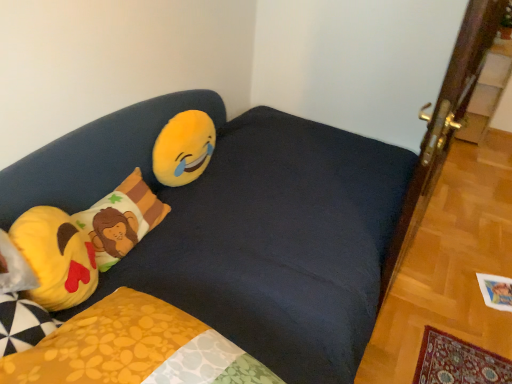
Question: Can you confirm if dark blue fabric studio couch at upper left is smaller than yellow plush emoji at upper left?

Choices:
 (A) no
 (B) yes

Answer: (A)

Question: Is dark blue fabric studio couch at upper left shorter than yellow plush emoji at upper left?

Choices:
 (A) yes
 (B) no

Answer: (B)

Question: Is dark blue fabric studio couch at upper left aimed at yellow plush emoji at upper left?

Choices:
 (A) no
 (B) yes

Answer: (A)

Question: Can you confirm if dark blue fabric studio couch at upper left is bigger than yellow plush emoji at upper left?

Choices:
 (A) no
 (B) yes

Answer: (B)

Question: Is dark blue fabric studio couch at upper left to the right of yellow plush emoji at upper left from the viewer's perspective?

Choices:
 (A) no
 (B) yes

Answer: (B)

Question: From a real-world perspective, is dark blue fabric studio couch at upper left over yellow plush emoji at upper left?

Choices:
 (A) yes
 (B) no

Answer: (B)

Question: Is yellow plush emoji at left, the 2th pillow viewed from the back, not inside fluffy cotton pillow with lion design at left, placed as the 1th pillow when sorted from back to front?

Choices:
 (A) yes
 (B) no

Answer: (A)

Question: From a real-world perspective, is yellow plush emoji at left, the 2th pillow viewed from the back, located higher than fluffy cotton pillow with lion design at left, placed as the 1th pillow when sorted from back to front?

Choices:
 (A) no
 (B) yes

Answer: (B)

Question: Can you confirm if yellow plush emoji at left, which is the 1th pillow in front-to-back order, is bigger than fluffy cotton pillow with lion design at left, placed as the 1th pillow when sorted from back to front?

Choices:
 (A) yes
 (B) no

Answer: (A)

Question: Is yellow plush emoji at left, the 2th pillow viewed from the back, thinner than fluffy cotton pillow with lion design at left, acting as the 2th pillow starting from the front?

Choices:
 (A) no
 (B) yes

Answer: (B)

Question: Is yellow plush emoji at left, which is the 1th pillow in front-to-back order, not close to fluffy cotton pillow with lion design at left, acting as the 2th pillow starting from the front?

Choices:
 (A) yes
 (B) no

Answer: (B)

Question: From the image's perspective, does yellow plush emoji at left, which is the 1th pillow in front-to-back order, appear higher than fluffy cotton pillow with lion design at left, placed as the 1th pillow when sorted from back to front?

Choices:
 (A) yes
 (B) no

Answer: (B)

Question: Is fluffy cotton pillow with lion design at left, placed as the 1th pillow when sorted from back to front, to the right of yellow plush emoji at upper left from the viewer's perspective?

Choices:
 (A) no
 (B) yes

Answer: (A)